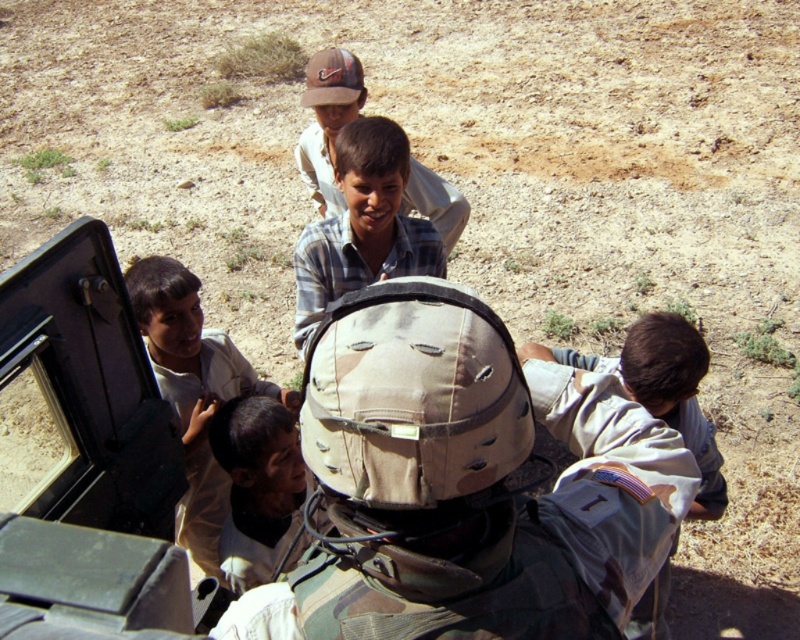
You are a drone operator trying to locate two points in the desert scene. The first point is at coordinates point (202,529) and the second point is at point (296,324). Which point is closer to the soldier?

Point (202,529) is in front of point (296,324), so it is closer to the soldier.

What object is located at the coordinates point (472, 480)?

The point (472, 480) marks the camouflage helmet at center.

Based on the scene description, which uniform is positioned higher in the image between the light brown uniform at center and the camouflage uniform at center?

The light brown uniform at center is positioned higher than the camouflage uniform at center in the image.